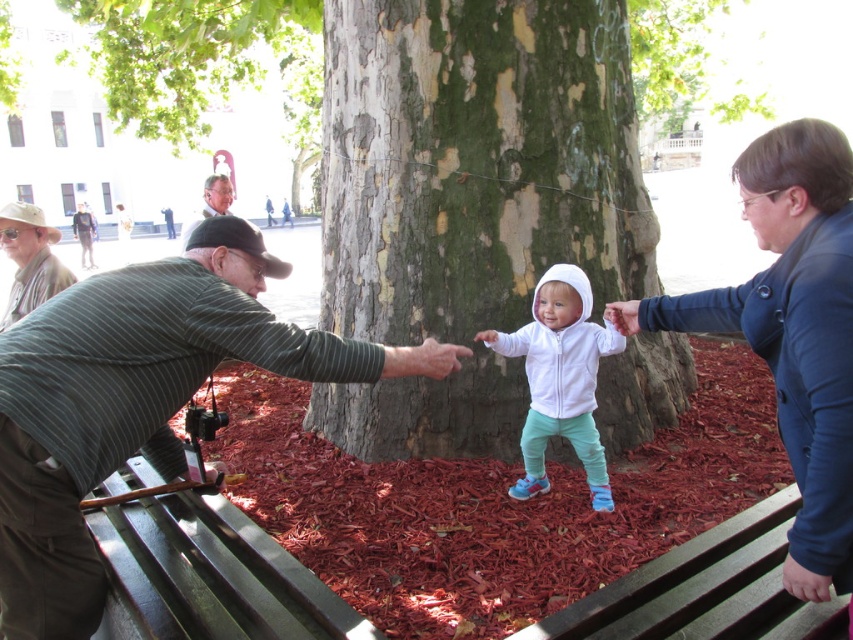
Is khaki cotton hat at left shorter than matte black cap at left?

Correct, khaki cotton hat at left is not as tall as matte black cap at left.

Measure the distance between khaki cotton hat at left and matte black cap at left.

A distance of 8.25 feet exists between khaki cotton hat at left and matte black cap at left.

Which is in front, point (19, 280) or point (204, 196)?

Point (19, 280) is more forward.

At what (x,y) coordinates should I click in order to perform the action: click on khaki cotton hat at left. Please return your answer as a coordinate pair (x, y). The width and height of the screenshot is (853, 640). Looking at the image, I should click on (30, 259).

Is point (564, 396) farther from camera compared to point (26, 204)?

That is False.

This screenshot has height=640, width=853. What are the coordinates of `white fleece jacket at center` in the screenshot? It's located at (560, 378).

Who is more distant from viewer, (x=254, y=301) or (x=792, y=355)?

Point (x=254, y=301)

Locate an element on the screen. The image size is (853, 640). striped fabric shirt at left is located at coordinates (137, 401).